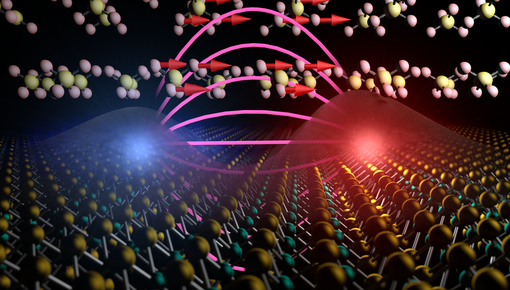
You are a GUI agent. You are given a task and a screenshot of the screen. Output one action in this format:
    pyautogui.click(x=<x>, y=<y>)
    Task: Click on the pink light
    The height and width of the screenshot is (290, 510).
    Given the screenshot: What is the action you would take?
    pyautogui.click(x=320, y=45)